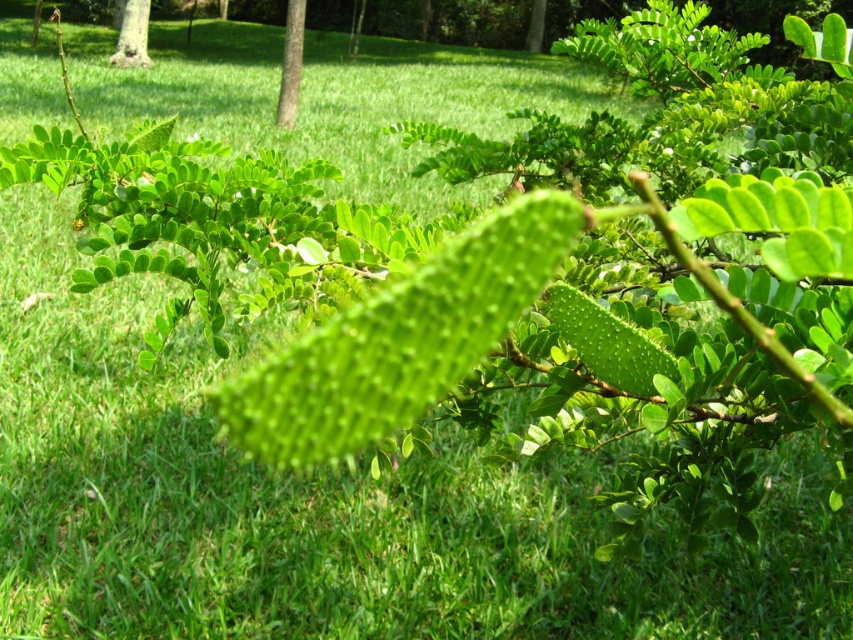
Question: Is green leafy tree at center further to the viewer compared to green matte tree at upper left?

Choices:
 (A) yes
 (B) no

Answer: (B)

Question: Observing the image, what is the correct spatial positioning of green leafy tree at center in reference to green matte tree at upper left?

Choices:
 (A) left
 (B) right

Answer: (B)

Question: Which point is closer to the camera?

Choices:
 (A) (131, 4)
 (B) (293, 10)

Answer: (B)

Question: Is green leafy tree at center positioned in front of green matte tree at upper left?

Choices:
 (A) no
 (B) yes

Answer: (B)

Question: Which object appears closest to the camera in this image?

Choices:
 (A) green matte tree at upper left
 (B) green leafy tree at center

Answer: (B)